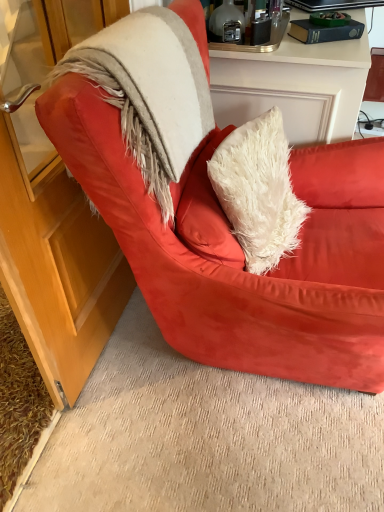
Question: Considering the relative sizes of fuzzy beige fur coat at upper left and black glossy laptop at upper right in the image provided, is fuzzy beige fur coat at upper left wider than black glossy laptop at upper right?

Choices:
 (A) no
 (B) yes

Answer: (B)

Question: Is fuzzy beige fur coat at upper left not near black glossy laptop at upper right?

Choices:
 (A) yes
 (B) no

Answer: (B)

Question: Considering the relative sizes of fuzzy beige fur coat at upper left and black glossy laptop at upper right in the image provided, is fuzzy beige fur coat at upper left smaller than black glossy laptop at upper right?

Choices:
 (A) no
 (B) yes

Answer: (A)

Question: Is fuzzy beige fur coat at upper left shorter than black glossy laptop at upper right?

Choices:
 (A) yes
 (B) no

Answer: (B)

Question: Is black glossy laptop at upper right a part of fuzzy beige fur coat at upper left?

Choices:
 (A) no
 (B) yes

Answer: (A)

Question: Does point (344, 300) appear closer or farther from the camera than point (382, 3)?

Choices:
 (A) farther
 (B) closer

Answer: (B)

Question: Which is correct: suede red armchair at center is inside black glossy laptop at upper right, or outside of it?

Choices:
 (A) outside
 (B) inside

Answer: (A)

Question: Is suede red armchair at center wider or thinner than black glossy laptop at upper right?

Choices:
 (A) thin
 (B) wide

Answer: (B)

Question: Looking at the image, does suede red armchair at center seem bigger or smaller compared to black glossy laptop at upper right?

Choices:
 (A) small
 (B) big

Answer: (B)

Question: From the image's perspective, is black glossy laptop at upper right above or below fuzzy beige fur coat at upper left?

Choices:
 (A) below
 (B) above

Answer: (B)

Question: From a real-world perspective, relative to fuzzy beige fur coat at upper left, is black glossy laptop at upper right vertically above or below?

Choices:
 (A) above
 (B) below

Answer: (B)

Question: Considering the positions of black glossy laptop at upper right and fuzzy beige fur coat at upper left in the image, is black glossy laptop at upper right taller or shorter than fuzzy beige fur coat at upper left?

Choices:
 (A) tall
 (B) short

Answer: (B)

Question: Is black glossy laptop at upper right wider or thinner than fuzzy beige fur coat at upper left?

Choices:
 (A) wide
 (B) thin

Answer: (B)

Question: In the image, is suede red armchair at center positioned in front of or behind fuzzy beige fur coat at upper left?

Choices:
 (A) behind
 (B) front

Answer: (B)

Question: Is suede red armchair at center to the left or to the right of fuzzy beige fur coat at upper left in the image?

Choices:
 (A) left
 (B) right

Answer: (B)